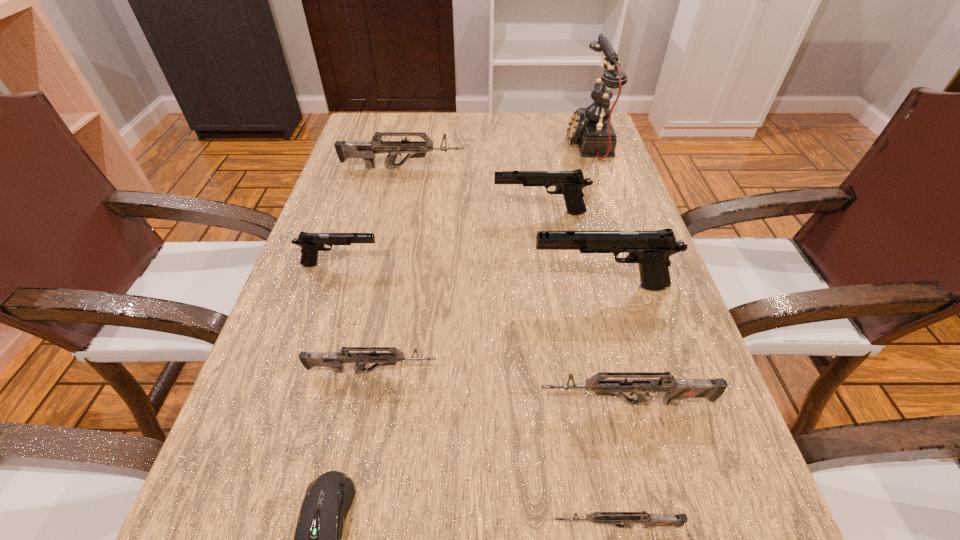
This screenshot has height=540, width=960. I want to click on vacant area situated at the aiming end of the fifth farthest object, so click(506, 286).

Locate an element on the screen. Image resolution: width=960 pixels, height=540 pixels. free spot located at the aiming end of the fifth farthest object is located at coordinates (378, 286).

The width and height of the screenshot is (960, 540). In order to click on vacant point located at the aiming end of the second farthest gun in this screenshot , I will do `click(438, 213)`.

Find the location of a particular element. This screenshot has height=540, width=960. free space located at the aiming end of the second farthest gun is located at coordinates (360, 213).

Locate an element on the screen. free space located at the aiming end of the second farthest gun is located at coordinates (x=472, y=213).

Identify the location of free location located aimed along the barrel of the farthest grey gun. (571, 167).

In order to click on vacant space situated 0.330m at the aiming end of the smallest black gun in this screenshot , I will do `click(541, 265)`.

Where is `vacant space located 0.210m aimed along the barrel of the third smallest grey gun`? The width and height of the screenshot is (960, 540). vacant space located 0.210m aimed along the barrel of the third smallest grey gun is located at coordinates (405, 403).

I want to click on vacant area located aimed along the barrel of the third smallest grey gun, so click(x=482, y=403).

Locate an element on the screen. Image resolution: width=960 pixels, height=540 pixels. vacant region located 0.060m aimed along the barrel of the third smallest grey gun is located at coordinates (501, 403).